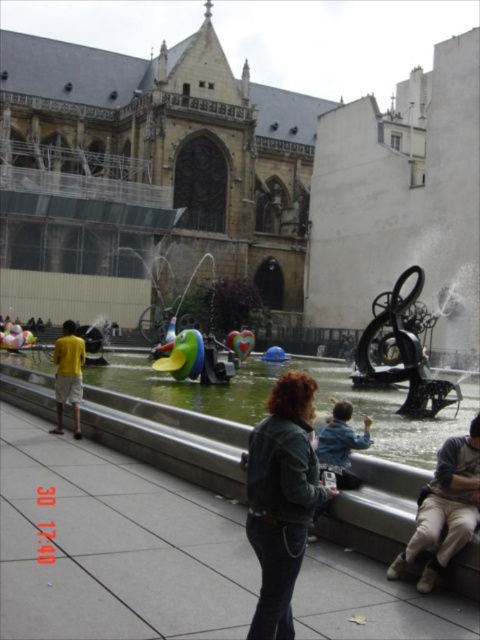
You are a photographer standing in the public square and want to capture both the denim jacket at lower right and the yellow cotton shirt at left in a single frame. Which clothing item should you adjust your camera angle towards to ensure both are visible?

The denim jacket at lower right is positioned on the right side of yellow cotton shirt at left. To capture both in a single frame, adjust your camera angle towards the right side where the denim jacket at lower right is located, ensuring the yellow cotton shirt at left remains in view on the left side.

You are standing in the public square and want to place both the denim jacket at lower right and the yellow cotton shirt at left on a shelf that requires items to be at least 1.2 meters tall. Can both items meet the height requirement?

The denim jacket at lower right is much taller than the yellow cotton shirt at left. Since the denim jacket at lower right meets the height requirement of 1.2 meters, but the yellow cotton shirt at left may not, only the denim jacket at lower right can be placed on the shelf.

You are a fashion designer observing a person in the public square. You notice the khaki cotton pants at lower right and the yellow cotton shirt at left. Which clothing item is shorter in length?

The khaki cotton pants at lower right is shorter than the yellow cotton shirt at left.